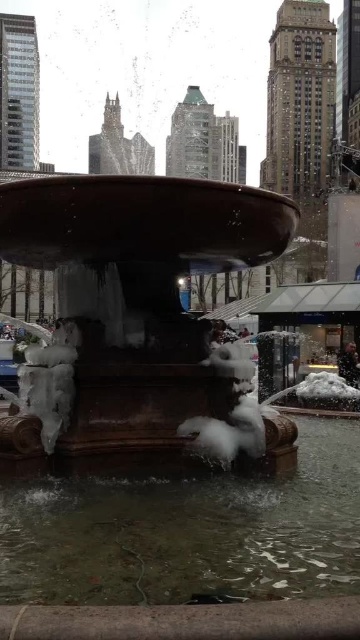
Question: Which point is closer to the camera?

Choices:
 (A) (150, 451)
 (B) (232, 524)

Answer: (B)

Question: Is bronze fountain at center bigger than clear water at fountain center?

Choices:
 (A) yes
 (B) no

Answer: (A)

Question: Which point appears farthest from the camera in this image?

Choices:
 (A) (56, 481)
 (B) (74, 211)

Answer: (A)

Question: Among these objects, which one is nearest to the camera?

Choices:
 (A) clear water at fountain center
 (B) bronze fountain at center

Answer: (A)

Question: Can you confirm if bronze fountain at center is wider than clear water at fountain center?

Choices:
 (A) no
 (B) yes

Answer: (B)

Question: Is bronze fountain at center behind clear water at fountain center?

Choices:
 (A) no
 (B) yes

Answer: (B)